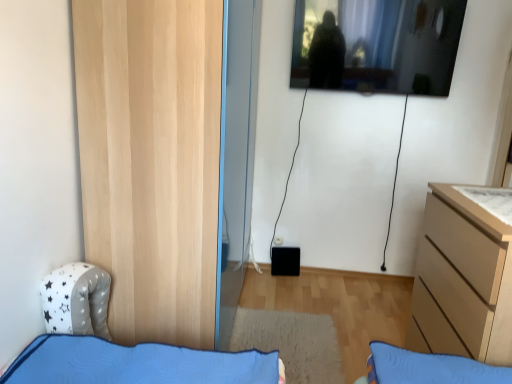
Where is `natural wood door at left`? The width and height of the screenshot is (512, 384). natural wood door at left is located at coordinates (151, 161).

Measure the distance between natural wood door at left and camera.

natural wood door at left is 1.58 meters away from camera.

What do you see at coordinates (376, 45) in the screenshot?
I see `transparent glass window at upper center` at bounding box center [376, 45].

This screenshot has height=384, width=512. What do you see at coordinates (462, 281) in the screenshot? I see `light wood chest of drawers at right` at bounding box center [462, 281].

At what (x,y) coordinates should I click in order to perform the action: click on light wood chest of drawers at right. Please return your answer as a coordinate pair (x, y). The height and width of the screenshot is (384, 512). Looking at the image, I should click on (462, 281).

Locate an element on the screen. The height and width of the screenshot is (384, 512). white matte drawer at upper right is located at coordinates (490, 200).

Can you confirm if light wood chest of drawers at right is shorter than transparent glass window at upper center?

In fact, light wood chest of drawers at right may be taller than transparent glass window at upper center.

Can transparent glass window at upper center be found inside light wood chest of drawers at right?

Actually, transparent glass window at upper center is outside light wood chest of drawers at right.

Is light wood chest of drawers at right with transparent glass window at upper center?

No, light wood chest of drawers at right is not in contact with transparent glass window at upper center.

From a real-world perspective, which is physically above, natural wood door at left or transparent glass window at upper center?

From a 3D spatial view, transparent glass window at upper center is above.

Is natural wood door at left to the right of transparent glass window at upper center from the viewer's perspective?

No, natural wood door at left is not to the right of transparent glass window at upper center.

Would you consider natural wood door at left to be distant from transparent glass window at upper center?

Yes, natural wood door at left and transparent glass window at upper center are quite far apart.

This screenshot has width=512, height=384. Find the location of `door below the transparent glass window at upper center (from a real-world perspective)`. door below the transparent glass window at upper center (from a real-world perspective) is located at coordinates (151, 161).

Looking at this image, is white matte drawer at upper right positioned with its back to natural wood door at left?

No, white matte drawer at upper right is not facing away from natural wood door at left.

From the picture: From a real-world perspective, which object rests below the other?

In real-world perspective, white matte drawer at upper right is lower.

Are white matte drawer at upper right and natural wood door at left beside each other?

white matte drawer at upper right and natural wood door at left are clearly separated.

Is white matte drawer at upper right facing away from transparent glass window at upper center?

white matte drawer at upper right is not turned away from transparent glass window at upper center.

Is white matte drawer at upper right situated inside transparent glass window at upper center or outside?

The correct answer is: outside.

Which point is more forward, [498,214] or [439,29]?

Positioned in front is point [498,214].

Considering the sizes of light wood chest of drawers at right and natural wood door at left in the image, is light wood chest of drawers at right taller or shorter than natural wood door at left?

light wood chest of drawers at right is shorter than natural wood door at left.

Is light wood chest of drawers at right positioned with its back to natural wood door at left?

No, light wood chest of drawers at right's orientation is not away from natural wood door at left.

Considering their positions, is light wood chest of drawers at right located in front of or behind natural wood door at left?

Clearly, light wood chest of drawers at right is in front of natural wood door at left.

Which is less distant, [362,76] or [440,351]?

Point [362,76] appears to be farther away from the viewer than point [440,351].

Measure the distance between transparent glass window at upper center and light wood chest of drawers at right.

transparent glass window at upper center is 4.71 feet away from light wood chest of drawers at right.

Considering the relative positions of transparent glass window at upper center and light wood chest of drawers at right in the image provided, is transparent glass window at upper center to the right of light wood chest of drawers at right from the viewer's perspective?

No.

Considering the relative sizes of transparent glass window at upper center and light wood chest of drawers at right in the image provided, is transparent glass window at upper center wider than light wood chest of drawers at right?

No, transparent glass window at upper center is not wider than light wood chest of drawers at right.

Considering the positions of point (380, 92) and point (480, 190), is point (380, 92) closer or farther from the camera than point (480, 190)?

Clearly, point (380, 92) is more distant from the camera than point (480, 190).

From a real-world perspective, is transparent glass window at upper center positioned above or below white matte drawer at upper right?

transparent glass window at upper center is situated higher than white matte drawer at upper right in the real world.

Is transparent glass window at upper center at the left side of white matte drawer at upper right?

Indeed, transparent glass window at upper center is positioned on the left side of white matte drawer at upper right.

The width and height of the screenshot is (512, 384). What are the coordinates of `window behind the white matte drawer at upper right` in the screenshot? It's located at (376, 45).

At what (x,y) coordinates should I click in order to perform the action: click on the chest of drawers that appears in front of the transparent glass window at upper center. Please return your answer as a coordinate pair (x, y). Looking at the image, I should click on (462, 281).

The height and width of the screenshot is (384, 512). What are the coordinates of `door on the left of transparent glass window at upper center` in the screenshot? It's located at (151, 161).

When comparing their distances from white matte drawer at upper right, does natural wood door at left or light wood chest of drawers at right seem further?

natural wood door at left lies further to white matte drawer at upper right than the other object.

Based on their spatial positions, is light wood chest of drawers at right or white matte drawer at upper right closer to transparent glass window at upper center?

Based on the image, white matte drawer at upper right appears to be nearer to transparent glass window at upper center.

Based on their spatial positions, is natural wood door at left or white matte drawer at upper right further from light wood chest of drawers at right?

natural wood door at left lies further to light wood chest of drawers at right than the other object.

From the image, which object appears to be nearer to natural wood door at left, white matte drawer at upper right or light wood chest of drawers at right?

Among the two, light wood chest of drawers at right is located nearer to natural wood door at left.

Looking at the image, which one is located closer to natural wood door at left, transparent glass window at upper center or light wood chest of drawers at right?

light wood chest of drawers at right is positioned closer to the anchor natural wood door at left.

From the image, which object appears to be nearer to transparent glass window at upper center, natural wood door at left or white matte drawer at upper right?

The object closer to transparent glass window at upper center is white matte drawer at upper right.

When comparing their distances from natural wood door at left, does light wood chest of drawers at right or transparent glass window at upper center seem further?

Among the two, transparent glass window at upper center is located further to natural wood door at left.

Looking at the image, which one is located closer to white matte drawer at upper right, light wood chest of drawers at right or transparent glass window at upper center?

light wood chest of drawers at right is positioned closer to the anchor white matte drawer at upper right.

Where is `sheet between transparent glass window at upper center and light wood chest of drawers at right from top to bottom`? The image size is (512, 384). sheet between transparent glass window at upper center and light wood chest of drawers at right from top to bottom is located at coordinates (490, 200).

Find the location of a particular element. The width and height of the screenshot is (512, 384). door between transparent glass window at upper center and light wood chest of drawers at right in the up-down direction is located at coordinates (151, 161).

Where is `window between natural wood door at left and white matte drawer at upper right`? This screenshot has width=512, height=384. window between natural wood door at left and white matte drawer at upper right is located at coordinates (376, 45).

I want to click on the chest of drawers situated between natural wood door at left and white matte drawer at upper right from left to right, so click(462, 281).